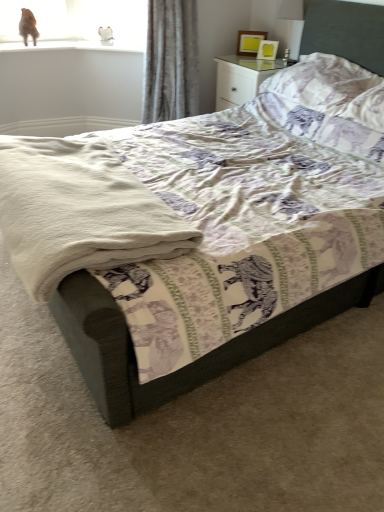
Question: Choose the correct answer: Is gray velvet curtain at upper center inside matte yellow picture frame at upper right or outside it?

Choices:
 (A) outside
 (B) inside

Answer: (A)

Question: Considering the positions of gray velvet curtain at upper center and matte yellow picture frame at upper right in the image, is gray velvet curtain at upper center bigger or smaller than matte yellow picture frame at upper right?

Choices:
 (A) big
 (B) small

Answer: (A)

Question: Estimate the real-world distances between objects in this image. Which object is closer to the matte yellow picture frame at upper right?

Choices:
 (A) white glossy nightstand at upper right
 (B) purple printed pillow at upper right
 (C) brown fur cat at upper left
 (D) white soft blanket at lower left
 (E) gray velvet curtain at upper center

Answer: (A)

Question: Which is farther from the white soft blanket at lower left?

Choices:
 (A) brown fur cat at upper left
 (B) white glossy nightstand at upper right
 (C) purple printed pillow at upper right
 (D) matte yellow picture frame at upper right
 (E) gray velvet curtain at upper center

Answer: (D)